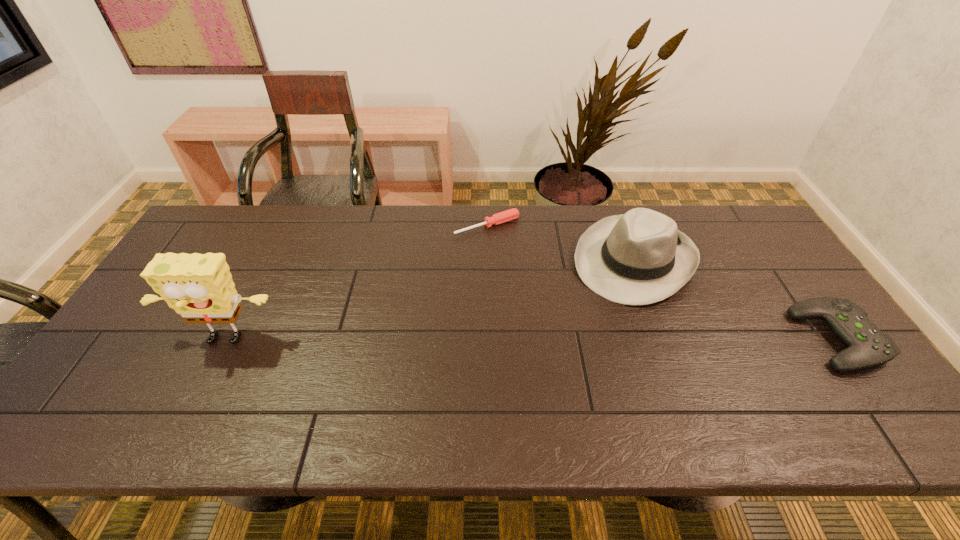
I want to click on vacant spot on the desktop that is between the leftmost object and the rightmost object and is positioned at the blade of the shortest object, so click(x=584, y=340).

At what (x,y) coordinates should I click in order to perform the action: click on free spot on the desktop that is between the leftmost object and the rightmost object and is positioned on the front-facing side of the third object from left to right. Please return your answer as a coordinate pair (x, y). Image resolution: width=960 pixels, height=540 pixels. Looking at the image, I should click on (572, 340).